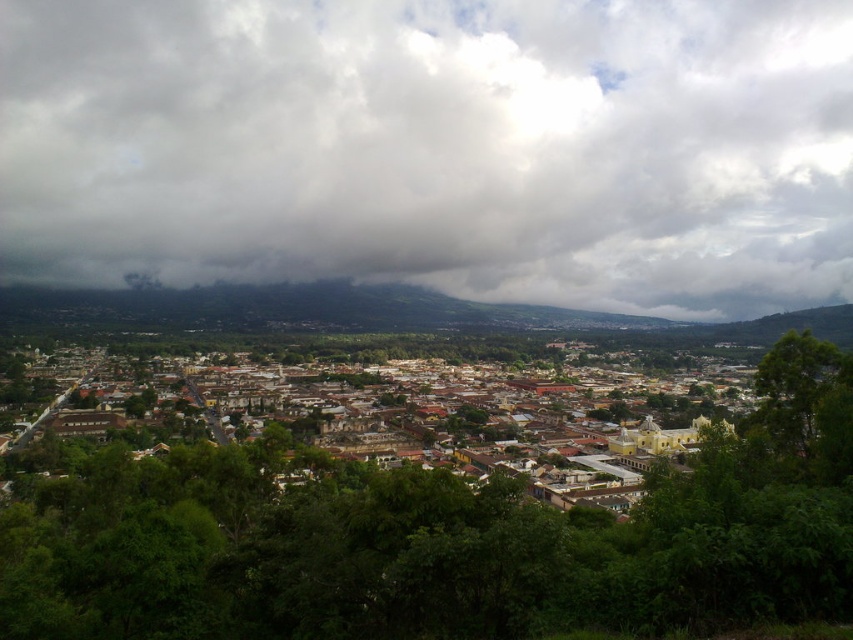
Question: Which object is farther from the camera taking this photo?

Choices:
 (A) white fluffy cloud at upper center
 (B) brown/weathered stone town at center

Answer: (A)

Question: Does white fluffy cloud at upper center appear on the left side of brown/weathered stone town at center?

Choices:
 (A) yes
 (B) no

Answer: (B)

Question: Is white fluffy cloud at upper center smaller than brown/weathered stone town at center?

Choices:
 (A) no
 (B) yes

Answer: (B)

Question: Among these points, which one is farthest from the camera?

Choices:
 (A) (6, 40)
 (B) (294, 376)

Answer: (A)

Question: Does white fluffy cloud at upper center appear on the right side of brown/weathered stone town at center?

Choices:
 (A) no
 (B) yes

Answer: (B)